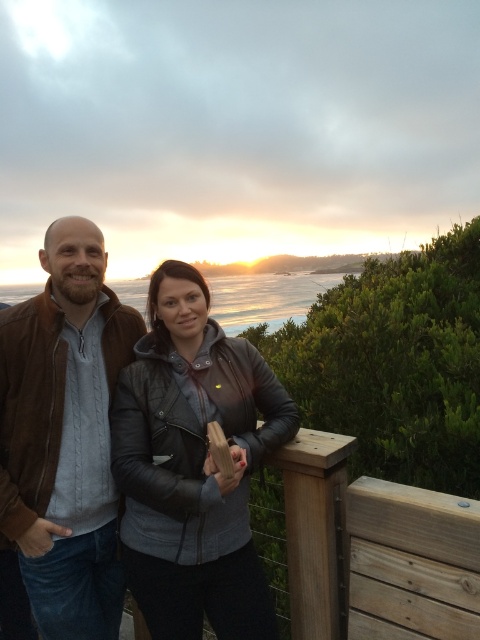
Is leather jacket at center to the left of brown leather jacket at left from the viewer's perspective?

No, leather jacket at center is not to the left of brown leather jacket at left.

Looking at this image, who is positioned more to the right, leather jacket at center or brown leather jacket at left?

leather jacket at center is more to the right.

You are a GUI agent. You are given a task and a screenshot of the screen. Output one action in this format:
    pyautogui.click(x=<x>, y=<y>)
    Task: Click on the leather jacket at center
    
    Given the screenshot: What is the action you would take?
    pyautogui.click(x=193, y=465)

Identify the location of leather jacket at center. The image size is (480, 640). (193, 465).

Does point (63, 273) come behind point (123, 288)?

No, it is in front of (123, 288).

Which is above, brown leather jacket at left or blue ocean at center?

blue ocean at center is above.

Does point (81, 308) come farther from viewer compared to point (266, 275)?

No.

Locate an element on the screen. The height and width of the screenshot is (640, 480). brown leather jacket at left is located at coordinates (64, 435).

Is point (228, 595) less distant than point (298, 280)?

Yes, it is in front of point (298, 280).

Is leather jacket at center further to camera compared to blue ocean at center?

That is False.

The height and width of the screenshot is (640, 480). I want to click on leather jacket at center, so click(193, 465).